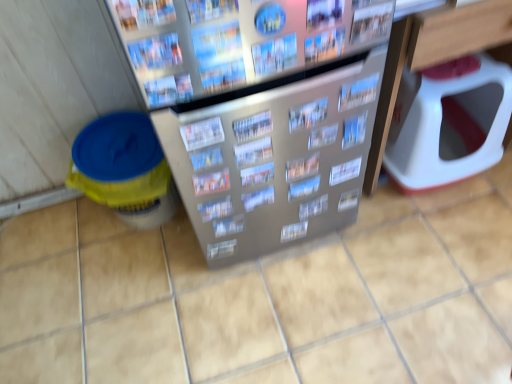
Question: Considering the relative sizes of metallic silver magazine at upper center, marked as the seventh magazine in a front-to-back arrangement, and printed paper magazine at center, arranged as the 12th magazine when viewed from the front, in the image provided, is metallic silver magazine at upper center, marked as the seventh magazine in a front-to-back arrangement, wider than printed paper magazine at center, arranged as the 12th magazine when viewed from the front,?

Choices:
 (A) no
 (B) yes

Answer: (A)

Question: Does metallic silver magazine at upper center, positioned as the 7th magazine in back-to-front order, have a smaller size compared to printed paper magazine at center, positioned as the 2th magazine in back-to-front order?

Choices:
 (A) no
 (B) yes

Answer: (B)

Question: Does metallic silver magazine at upper center, marked as the seventh magazine in a front-to-back arrangement, turn towards printed paper magazine at center, positioned as the 2th magazine in back-to-front order?

Choices:
 (A) yes
 (B) no

Answer: (B)

Question: Does metallic silver magazine at upper center, marked as the seventh magazine in a front-to-back arrangement, come behind printed paper magazine at center, arranged as the 12th magazine when viewed from the front?

Choices:
 (A) yes
 (B) no

Answer: (B)

Question: From the image's perspective, does metallic silver magazine at upper center, marked as the seventh magazine in a front-to-back arrangement, appear higher than printed paper magazine at center, arranged as the 12th magazine when viewed from the front?

Choices:
 (A) no
 (B) yes

Answer: (B)

Question: Considering the relative positions of metallic silver magazine at center, which appears as the fourth magazine when viewed from the back, and printed paper magazine at center, the eleventh magazine in the back-to-front sequence, in the image provided, is metallic silver magazine at center, which appears as the fourth magazine when viewed from the back, to the left or to the right of printed paper magazine at center, the eleventh magazine in the back-to-front sequence,?

Choices:
 (A) right
 (B) left

Answer: (A)

Question: From the image's perspective, relative to printed paper magazine at center, acting as the third magazine starting from the front, is metallic silver magazine at center, the tenth magazine in the front-to-back sequence, above or below?

Choices:
 (A) below
 (B) above

Answer: (B)

Question: From a real-world perspective, is metallic silver magazine at center, which appears as the fourth magazine when viewed from the back, above or below printed paper magazine at center, acting as the third magazine starting from the front?

Choices:
 (A) below
 (B) above

Answer: (A)

Question: Relative to printed paper magazine at center, the eleventh magazine in the back-to-front sequence, is metallic silver magazine at center, the tenth magazine in the front-to-back sequence, in front or behind?

Choices:
 (A) front
 (B) behind

Answer: (B)

Question: Is printed paper magazine at center, the ninth magazine from the front, to the left or to the right of printed paper magazine at upper center, positioned as the 12th magazine in back-to-front order, in the image?

Choices:
 (A) left
 (B) right

Answer: (B)

Question: In terms of width, does printed paper magazine at center, the ninth magazine from the front, look wider or thinner when compared to printed paper magazine at upper center, positioned as the 12th magazine in back-to-front order?

Choices:
 (A) wide
 (B) thin

Answer: (A)

Question: Considering the positions of point (242, 125) and point (145, 48), is point (242, 125) closer or farther from the camera than point (145, 48)?

Choices:
 (A) farther
 (B) closer

Answer: (A)

Question: From a real-world perspective, relative to printed paper magazine at upper center, placed as the 2th magazine when sorted from front to back, is printed paper magazine at center, which appears as the 5th magazine when viewed from the back, vertically above or below?

Choices:
 (A) above
 (B) below

Answer: (B)

Question: From a real-world perspective, is yellow plastic bucket at left positioned above or below printed paper magazine at center, which is counted as the 6th magazine, starting from the back?

Choices:
 (A) above
 (B) below

Answer: (B)

Question: Considering the positions of yellow plastic bucket at left and printed paper magazine at center, marked as the 8th magazine in a front-to-back arrangement, in the image, is yellow plastic bucket at left bigger or smaller than printed paper magazine at center, marked as the 8th magazine in a front-to-back arrangement,?

Choices:
 (A) small
 (B) big

Answer: (B)